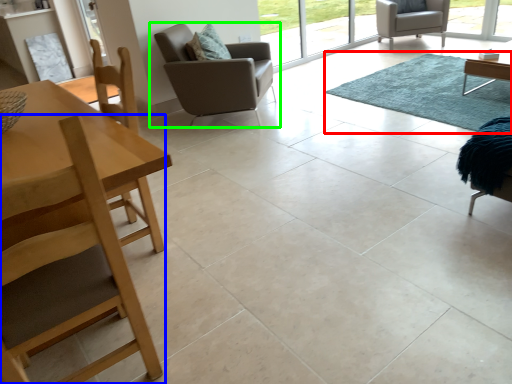
Question: Which object is positioned closest to mat (highlighted by a red box)? Select from chair (highlighted by a blue box) and chair (highlighted by a green box).

Choices:
 (A) chair
 (B) chair

Answer: (B)